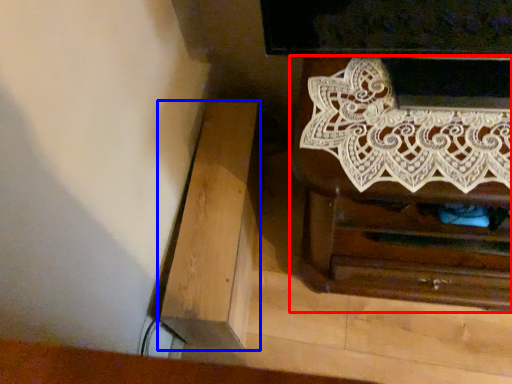
Question: Which object appears farthest to the camera in this image, chest of drawers (highlighted by a red box) or furniture (highlighted by a blue box)?

Choices:
 (A) chest of drawers
 (B) furniture

Answer: (B)